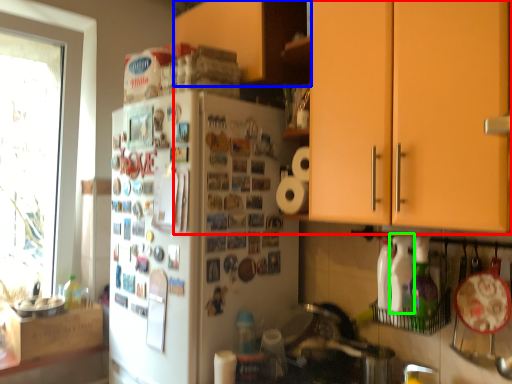
Question: Based on their relative distances, which object is nearer to cabinetry (highlighted by a red box)? Choose from cabinetry (highlighted by a blue box) and bottle (highlighted by a green box).

Choices:
 (A) cabinetry
 (B) bottle

Answer: (B)